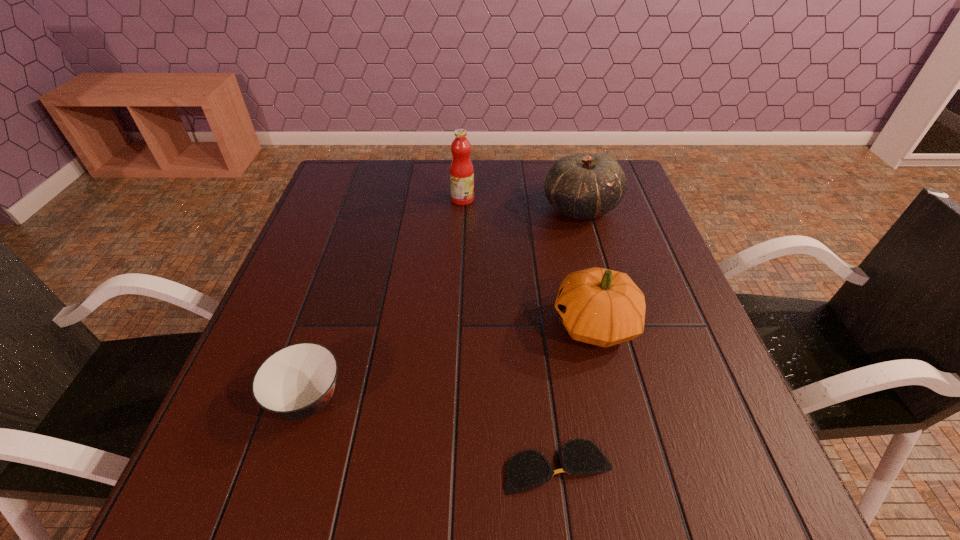
Find the location of a particular element. The image size is (960, 540). vacant space located on the side of the third nearest object with the carved face is located at coordinates (499, 324).

Identify the location of vacant space situated 0.310m on the side of the third nearest object with the carved face. (405, 324).

Identify the location of vacant space located 0.360m on the side of the third nearest object with the carved face. click(381, 324).

The image size is (960, 540). I want to click on vacant space located 0.150m on the back of the soup bowl, so click(x=336, y=309).

Locate an element on the screen. vacant space located 0.260m on the left of the shortest object is located at coordinates (344, 467).

This screenshot has width=960, height=540. What are the coordinates of `fruit juice present at the far edge` in the screenshot? It's located at (461, 170).

The width and height of the screenshot is (960, 540). In order to click on gourd at the far edge in this screenshot , I will do tap(584, 186).

Find the location of `object present at the near edge`. object present at the near edge is located at coordinates point(527,469).

You are a GUI agent. You are given a task and a screenshot of the screen. Output one action in this format:
    pyautogui.click(x=<x>, y=<y>)
    Task: Click on the object that is positioned at the left edge
    
    Given the screenshot: What is the action you would take?
    pyautogui.click(x=297, y=381)

Where is `object located in the far right corner section of the desktop`? The image size is (960, 540). object located in the far right corner section of the desktop is located at coordinates (584, 186).